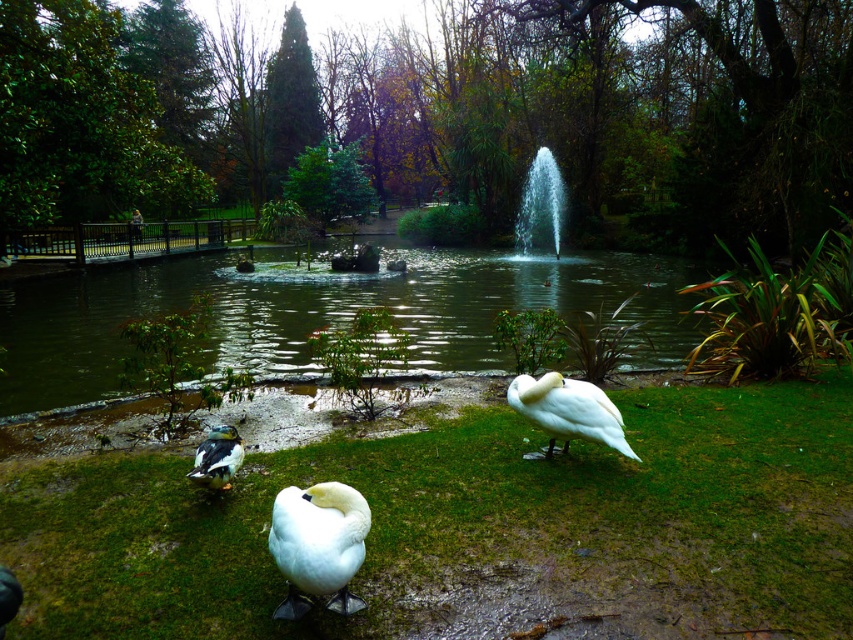
Question: Does white matte swan at center have a smaller size compared to white glossy swan at center?

Choices:
 (A) yes
 (B) no

Answer: (A)

Question: Which object appears closest to the camera in this image?

Choices:
 (A) white glossy swan at center
 (B) greenish-blue glossy duck at lower left
 (C) white matte swan at center

Answer: (C)

Question: Estimate the real-world distances between objects in this image. Which object is closer to the greenish-blue glossy duck at lower left?

Choices:
 (A) brushed metal bench at left
 (B) clear glass fountain at center

Answer: (A)

Question: Which point is farther to the camera?

Choices:
 (A) (560, 237)
 (B) (596, 404)
 (C) (137, 224)
 (D) (318, 524)

Answer: (A)

Question: Does green grassy lake at center have a greater width compared to greenish-blue glossy duck at lower left?

Choices:
 (A) no
 (B) yes

Answer: (B)

Question: Is green grass at lower center above white glossy swan at center?

Choices:
 (A) no
 (B) yes

Answer: (A)